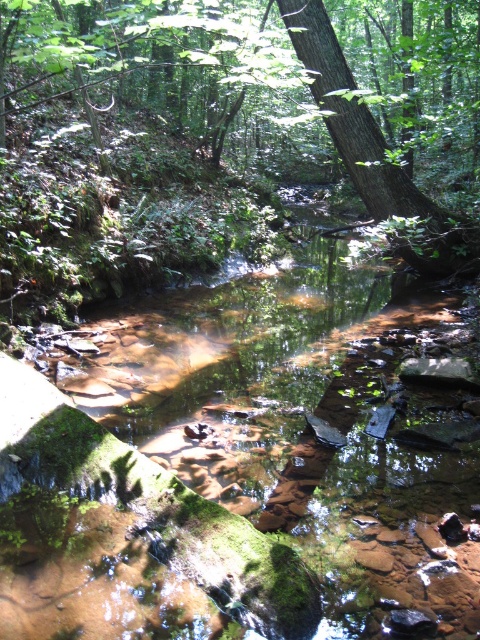
You are a hiker who wants to cross the stream. You see the clear water at center and the green leafy tree at center. Which object is above the other?

The green leafy tree at center is above the clear water at center because the water is positioned under the tree.

You are standing at the edge of the forest stream and want to cross to the other side. The clear water at center is in your path. Can you step over it without getting your feet wet?

The clear water at center is located at point (x=303, y=420), which suggests it is positioned in the middle of the stream. Since the water is shallow and clear, you can likely step over it without getting your feet wet by carefully placing your foot on the nearby rocks or stones mentioned in the scene description.

You are a hiker who wants to cross the stream. You see the green leafy tree at center and the green rough bark tree at center. Which tree has a wider trunk that could provide a stable handhold for crossing?

The green leafy tree at center has a wider trunk than the green rough bark tree at center, so it provides a more stable handhold for crossing the stream.